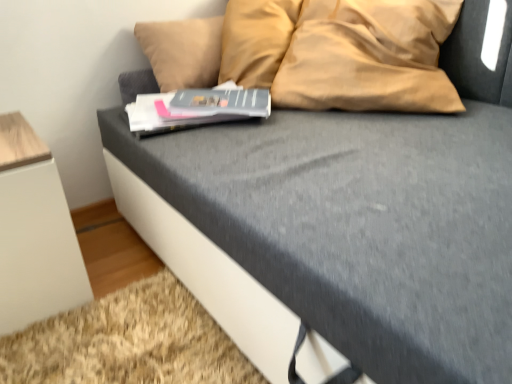
At what (x,y) coordinates should I click in order to perform the action: click on hardcover book at center, arranged as the second paperback book when viewed from the back. Please return your answer as a coordinate pair (x, y). Looking at the image, I should click on (196, 108).

Locate an element on the screen. white matte cabinet at lower left is located at coordinates (34, 232).

Find the location of `matte gray paperback book at center, marked as the 2th paperback book in a front-to-back arrangement`. matte gray paperback book at center, marked as the 2th paperback book in a front-to-back arrangement is located at coordinates (221, 102).

From the image's perspective, is matte gray paperback book at center, arranged as the 1th paperback book when viewed from the back, positioned above or below hardcover book at center, arranged as the second paperback book when viewed from the back?

From the image's perspective, matte gray paperback book at center, arranged as the 1th paperback book when viewed from the back, appears above hardcover book at center, arranged as the second paperback book when viewed from the back.

From a real-world perspective, who is located lower, matte gray paperback book at center, marked as the 2th paperback book in a front-to-back arrangement, or hardcover book at center, arranged as the second paperback book when viewed from the back?

hardcover book at center, arranged as the second paperback book when viewed from the back.

Considering the relative positions of matte gray paperback book at center, marked as the 2th paperback book in a front-to-back arrangement, and hardcover book at center, which is the 1th paperback book from front to back, in the image provided, is matte gray paperback book at center, marked as the 2th paperback book in a front-to-back arrangement, to the right of hardcover book at center, which is the 1th paperback book from front to back, from the viewer's perspective?

Yes, matte gray paperback book at center, marked as the 2th paperback book in a front-to-back arrangement, is to the right of hardcover book at center, which is the 1th paperback book from front to back.

Is hardcover book at center, which is the 1th paperback book from front to back, spatially inside white matte cabinet at lower left, or outside of it?

hardcover book at center, which is the 1th paperback book from front to back, is not enclosed by white matte cabinet at lower left.

Which of these two, hardcover book at center, which is the 1th paperback book from front to back, or white matte cabinet at lower left, is wider?

white matte cabinet at lower left is wider.

The height and width of the screenshot is (384, 512). I want to click on furniture in front of the hardcover book at center, arranged as the second paperback book when viewed from the back, so click(34, 232).

Is point (181, 107) farther from camera compared to point (7, 284)?

Yes.

From the picture: From a real-world perspective, between matte gray paperback book at center, marked as the 2th paperback book in a front-to-back arrangement, and white matte cabinet at lower left, who is vertically lower?

From a 3D spatial view, white matte cabinet at lower left is below.

Looking at this image, is matte gray paperback book at center, marked as the 2th paperback book in a front-to-back arrangement, closer to camera compared to white matte cabinet at lower left?

No.

Does matte gray paperback book at center, marked as the 2th paperback book in a front-to-back arrangement, have a lesser width compared to white matte cabinet at lower left?

Yes.

Would you consider white matte cabinet at lower left to be distant from hardcover book at center, arranged as the second paperback book when viewed from the back?

No, there isn't a large distance between white matte cabinet at lower left and hardcover book at center, arranged as the second paperback book when viewed from the back.

Considering the positions of objects white matte cabinet at lower left and hardcover book at center, arranged as the second paperback book when viewed from the back, in the image provided, who is more to the left, white matte cabinet at lower left or hardcover book at center, arranged as the second paperback book when viewed from the back,?

Positioned to the left is white matte cabinet at lower left.

Looking at their sizes, would you say white matte cabinet at lower left is wider or thinner than hardcover book at center, arranged as the second paperback book when viewed from the back?

In the image, white matte cabinet at lower left appears to be wider than hardcover book at center, arranged as the second paperback book when viewed from the back.

Locate an element on the screen. paperback book below the matte gray paperback book at center, arranged as the 1th paperback book when viewed from the back (from a real-world perspective) is located at coordinates (196, 108).

Is hardcover book at center, arranged as the second paperback book when viewed from the back, facing towards matte gray paperback book at center, arranged as the 1th paperback book when viewed from the back?

No.

From a real-world perspective, is hardcover book at center, arranged as the second paperback book when viewed from the back, located higher than matte gray paperback book at center, marked as the 2th paperback book in a front-to-back arrangement?

No.

Considering the positions of objects white matte cabinet at lower left and matte gray paperback book at center, marked as the 2th paperback book in a front-to-back arrangement, in the image provided, who is behind, white matte cabinet at lower left or matte gray paperback book at center, marked as the 2th paperback book in a front-to-back arrangement,?

Positioned behind is matte gray paperback book at center, marked as the 2th paperback book in a front-to-back arrangement.

Which of these two, white matte cabinet at lower left or matte gray paperback book at center, marked as the 2th paperback book in a front-to-back arrangement, stands shorter?

Standing shorter between the two is matte gray paperback book at center, marked as the 2th paperback book in a front-to-back arrangement.

From the image's perspective, is white matte cabinet at lower left above or below matte gray paperback book at center, arranged as the 1th paperback book when viewed from the back?

Based on their image positions, white matte cabinet at lower left is located beneath matte gray paperback book at center, arranged as the 1th paperback book when viewed from the back.

Can you tell me how much white matte cabinet at lower left and matte gray paperback book at center, arranged as the 1th paperback book when viewed from the back, differ in facing direction?

They differ by 36.1 degrees in their facing directions.

At what (x,y) coordinates should I click in order to perform the action: click on paperback book that is behind the hardcover book at center, which is the 1th paperback book from front to back. Please return your answer as a coordinate pair (x, y). Image resolution: width=512 pixels, height=384 pixels. Looking at the image, I should click on (221, 102).

You are a GUI agent. You are given a task and a screenshot of the screen. Output one action in this format:
    pyautogui.click(x=<x>, y=<y>)
    Task: Click on the 1st paperback book to the right of the white matte cabinet at lower left, starting your count from the anchor
    This screenshot has height=384, width=512.
    Given the screenshot: What is the action you would take?
    pyautogui.click(x=196, y=108)

When comparing their distances from matte gray paperback book at center, marked as the 2th paperback book in a front-to-back arrangement, does white matte cabinet at lower left or hardcover book at center, which is the 1th paperback book from front to back, seem closer?

hardcover book at center, which is the 1th paperback book from front to back, is positioned closer to the anchor matte gray paperback book at center, marked as the 2th paperback book in a front-to-back arrangement.

From the image, which object appears to be farther from white matte cabinet at lower left, matte gray paperback book at center, marked as the 2th paperback book in a front-to-back arrangement, or hardcover book at center, which is the 1th paperback book from front to back?

Based on the image, matte gray paperback book at center, marked as the 2th paperback book in a front-to-back arrangement, appears to be further to white matte cabinet at lower left.

Considering their positions, is hardcover book at center, arranged as the second paperback book when viewed from the back, positioned closer to matte gray paperback book at center, arranged as the 1th paperback book when viewed from the back, than white matte cabinet at lower left?

Among the two, hardcover book at center, arranged as the second paperback book when viewed from the back, is located nearer to matte gray paperback book at center, arranged as the 1th paperback book when viewed from the back.

Based on their spatial positions, is matte gray paperback book at center, marked as the 2th paperback book in a front-to-back arrangement, or white matte cabinet at lower left further from hardcover book at center, arranged as the second paperback book when viewed from the back?

white matte cabinet at lower left.

From the image, which object appears to be nearer to white matte cabinet at lower left, hardcover book at center, arranged as the second paperback book when viewed from the back, or matte gray paperback book at center, marked as the 2th paperback book in a front-to-back arrangement?

The object closer to white matte cabinet at lower left is hardcover book at center, arranged as the second paperback book when viewed from the back.

Which object lies nearer to the anchor point hardcover book at center, which is the 1th paperback book from front to back, white matte cabinet at lower left or matte gray paperback book at center, arranged as the 1th paperback book when viewed from the back?

The object closer to hardcover book at center, which is the 1th paperback book from front to back, is matte gray paperback book at center, arranged as the 1th paperback book when viewed from the back.

Locate an element on the screen. paperback book between white matte cabinet at lower left and matte gray paperback book at center, marked as the 2th paperback book in a front-to-back arrangement, from left to right is located at coordinates (196, 108).